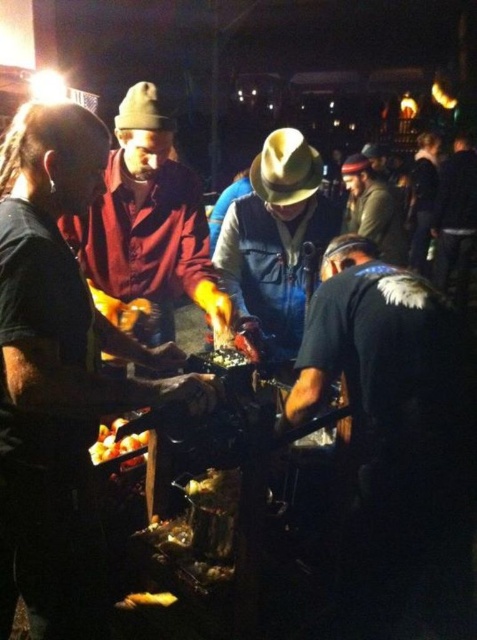
Does black leather jacket at lower right appear on the right side of tan felt cowboy hat at center?

Indeed, black leather jacket at lower right is positioned on the right side of tan felt cowboy hat at center.

Is black leather jacket at lower right thinner than tan felt cowboy hat at center?

No.

Image resolution: width=477 pixels, height=640 pixels. In order to click on black leather jacket at lower right in this screenshot , I will do `click(393, 433)`.

Locate an element on the screen. black leather jacket at lower right is located at coordinates (393, 433).

Consider the image. Is brown felt cowboy hat at upper center bigger than golden crispy bread at lower center?

Correct, brown felt cowboy hat at upper center is larger in size than golden crispy bread at lower center.

Can you confirm if brown felt cowboy hat at upper center is positioned to the left of golden crispy bread at lower center?

Correct, you'll find brown felt cowboy hat at upper center to the left of golden crispy bread at lower center.

Does point (158, 99) lie behind point (147, 592)?

Yes.

The image size is (477, 640). In order to click on brown felt cowboy hat at upper center in this screenshot , I will do `click(144, 109)`.

Is point (356, 188) farther from viewer compared to point (158, 113)?

Yes, point (356, 188) is farther from viewer.

Is point (374, 216) closer to viewer compared to point (146, 109)?

No, (374, 216) is further to viewer.

Where is `green felt hat at upper right`? The height and width of the screenshot is (640, 477). green felt hat at upper right is located at coordinates (373, 209).